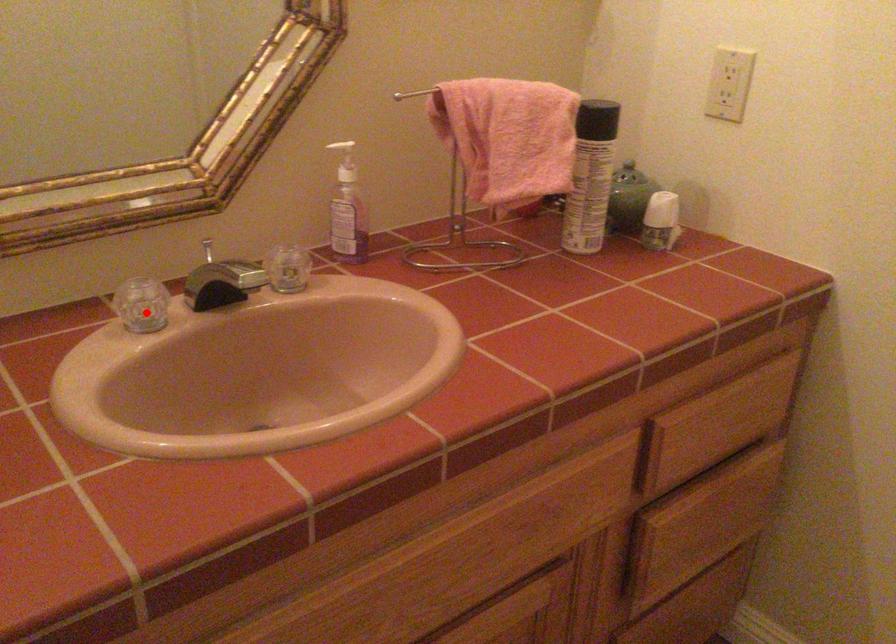
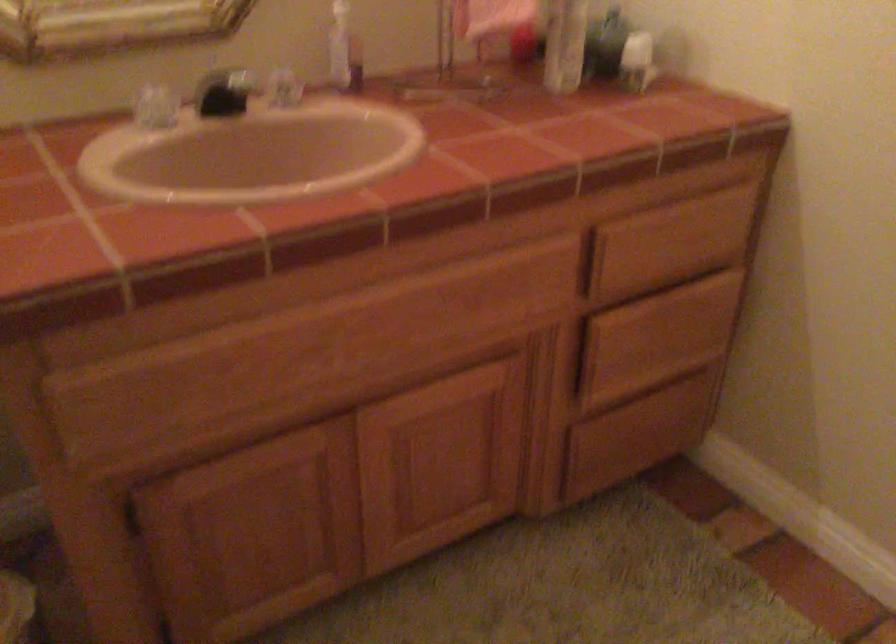
Question: I am providing you with two images of the same scene from different viewpoints. Given a red point in image1, look at the same physical point in image2. Is it:

Choices:
 (A) Closer to the viewpoint
 (B) Farther from the viewpoint

Answer: (B)